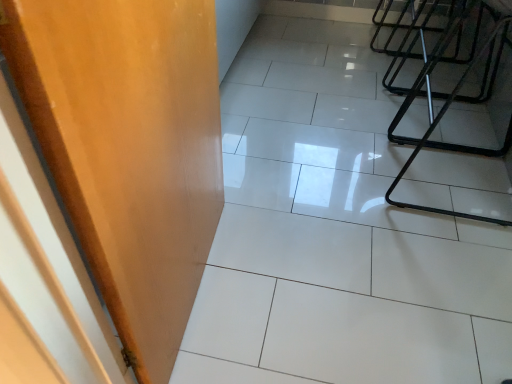
The height and width of the screenshot is (384, 512). Identify the location of vacant area situated below wooden door at left (from a real-world perspective). (198, 296).